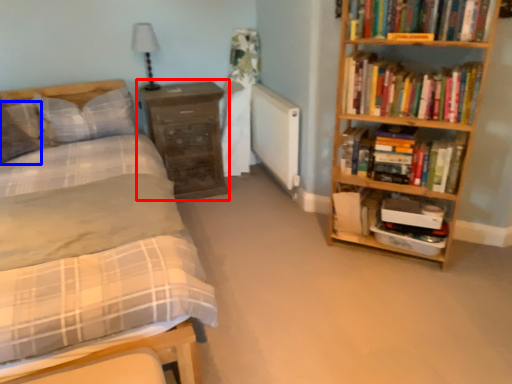
Question: Which object appears farthest to the camera in this image, chest of drawers (highlighted by a red box) or pillow (highlighted by a blue box)?

Choices:
 (A) chest of drawers
 (B) pillow

Answer: (A)